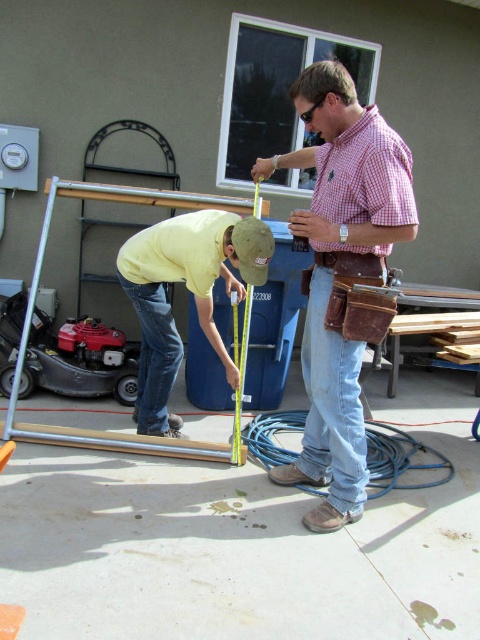
Is checkered fabric shirt at center wider than yellow cotton shirt at lower left?

In fact, checkered fabric shirt at center might be narrower than yellow cotton shirt at lower left.

The height and width of the screenshot is (640, 480). Identify the location of checkered fabric shirt at center. (333, 273).